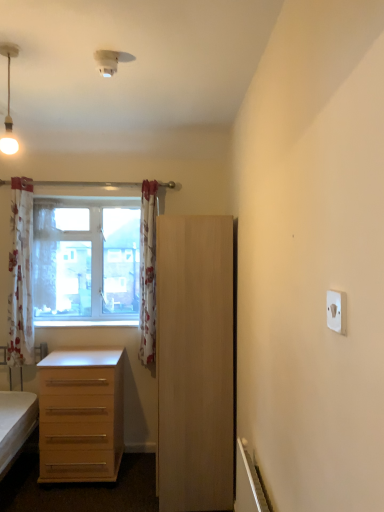
Where is `vacant area that lies between light wood drawer at lower left and light wood cabinet at center`? vacant area that lies between light wood drawer at lower left and light wood cabinet at center is located at coordinates (121, 487).